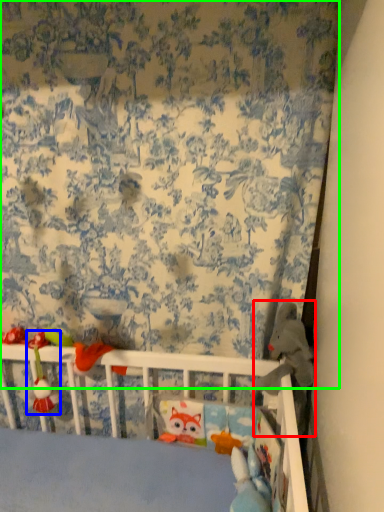
Question: Based on their relative distances, which object is nearer to toy (highlighted by a red box)? Choose from toy (highlighted by a blue box) and curtain (highlighted by a green box).

Choices:
 (A) toy
 (B) curtain

Answer: (B)